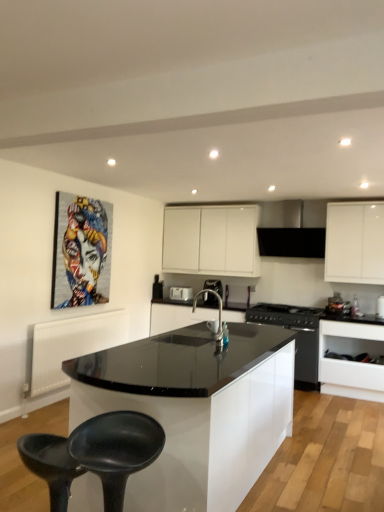
The height and width of the screenshot is (512, 384). I want to click on vacant region above black matte range hood at upper center, arranged as the 2th kitchen appliance when ordered from the bottom (from a real-world perspective), so click(291, 200).